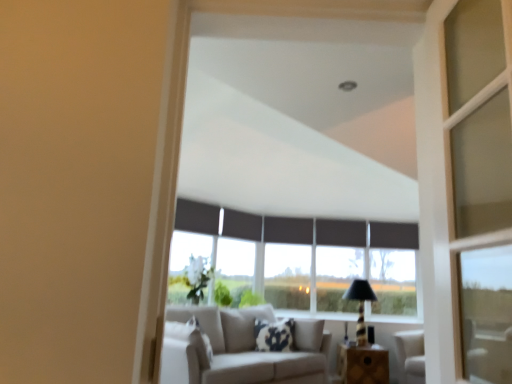
Question: Which direction should I rotate to look at dark matte curtain at center, the fifth curtain viewed from the front?

Choices:
 (A) right
 (B) left

Answer: (A)

Question: Considering the relative positions of black fabric curtain at center, the second curtain viewed from the back, and wooden table at lower center in the image provided, is black fabric curtain at center, the second curtain viewed from the back, to the left of wooden table at lower center from the viewer's perspective?

Choices:
 (A) no
 (B) yes

Answer: (B)

Question: Can you confirm if black fabric curtain at center, marked as the 4th curtain in a left-to-right arrangement, is thinner than wooden table at lower center?

Choices:
 (A) no
 (B) yes

Answer: (B)

Question: Does black fabric curtain at center, placed as the second curtain when sorted from right to left, have a smaller size compared to wooden table at lower center?

Choices:
 (A) yes
 (B) no

Answer: (A)

Question: From the image's perspective, is black fabric curtain at center, placed as the second curtain when sorted from right to left, on wooden table at lower center?

Choices:
 (A) yes
 (B) no

Answer: (A)

Question: From a real-world perspective, does black fabric curtain at center, which ranks as the fourth curtain in front-to-back order, stand above wooden table at lower center?

Choices:
 (A) yes
 (B) no

Answer: (A)

Question: Is black fabric curtain at center, the second curtain viewed from the back, with wooden table at lower center?

Choices:
 (A) yes
 (B) no

Answer: (B)

Question: From the image's perspective, would you say black fabric curtain at center, the second curtain viewed from the back, is shown under fluffy white pillow at center?

Choices:
 (A) yes
 (B) no

Answer: (B)

Question: From a real-world perspective, is black fabric curtain at center, which ranks as the fourth curtain in front-to-back order, positioned under fluffy white pillow at center based on gravity?

Choices:
 (A) yes
 (B) no

Answer: (B)

Question: Is black fabric curtain at center, which ranks as the fourth curtain in front-to-back order, outside fluffy white pillow at center?

Choices:
 (A) no
 (B) yes

Answer: (B)

Question: Is black fabric curtain at center, marked as the 4th curtain in a left-to-right arrangement, far from fluffy white pillow at center?

Choices:
 (A) no
 (B) yes

Answer: (B)

Question: Considering the relative sizes of black fabric curtain at center, which ranks as the fourth curtain in front-to-back order, and fluffy white pillow at center in the image provided, is black fabric curtain at center, which ranks as the fourth curtain in front-to-back order, bigger than fluffy white pillow at center?

Choices:
 (A) no
 (B) yes

Answer: (A)

Question: Is fluffy white pillow at center located within black fabric curtain at center, placed as the second curtain when sorted from right to left?

Choices:
 (A) yes
 (B) no

Answer: (B)

Question: Can you confirm if black fabric curtain at upper center, arranged as the fifth curtain when viewed from the back, is wider than black fabric curtain at center, which appears as the second curtain when viewed from the front?

Choices:
 (A) no
 (B) yes

Answer: (B)